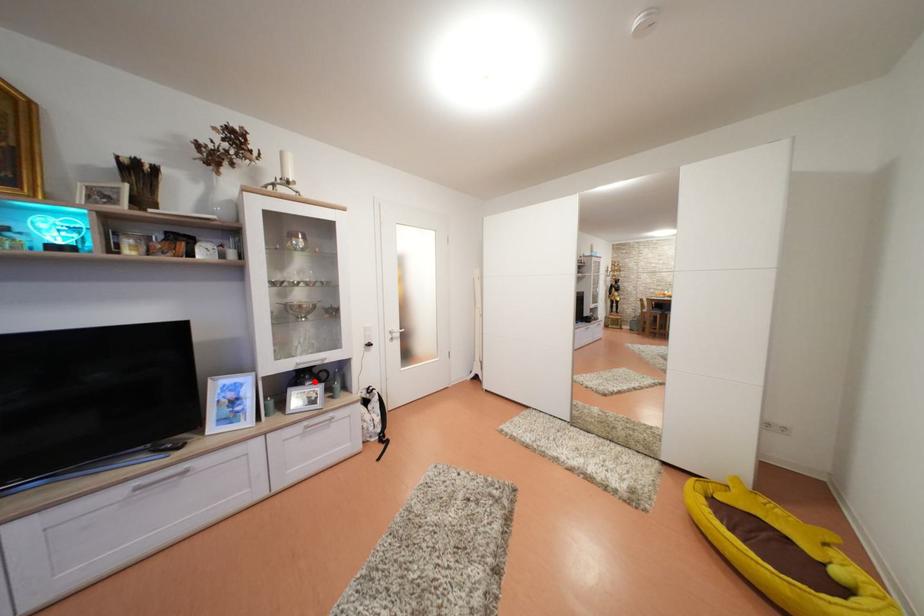
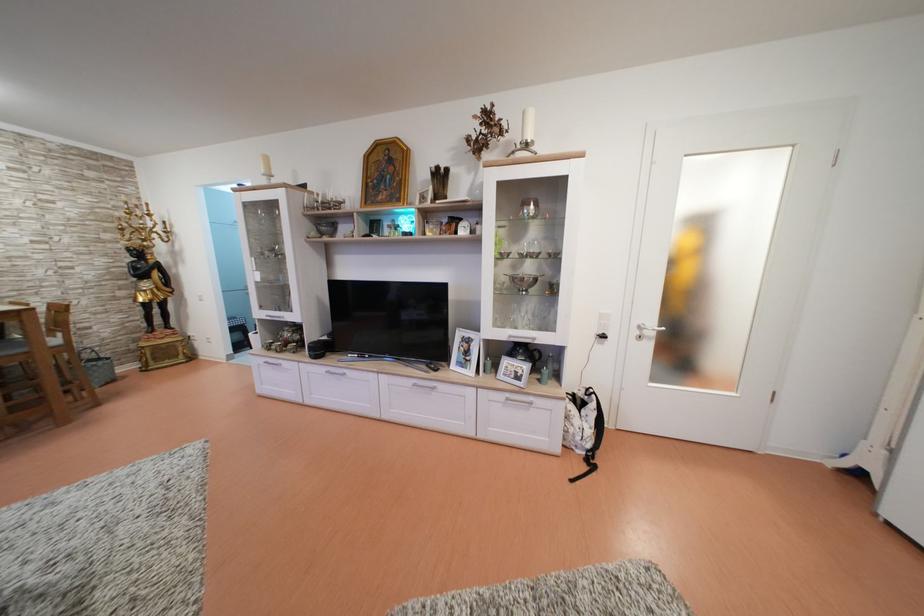
Question: I am providing you with two images of the same scene from different viewpoints. Given a red point in image1, look at the same physical point in image2. Is it:

Choices:
 (A) Closer to the viewpoint
 (B) Farther from the viewpoint

Answer: (B)